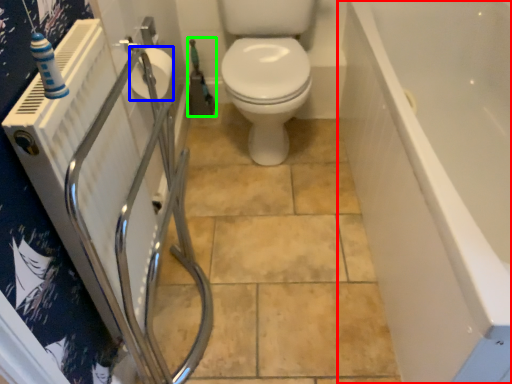
Question: Based on their relative distances, which object is farther from bath (highlighted by a red box)? Choose from toilet paper (highlighted by a blue box) and garden hose (highlighted by a green box).

Choices:
 (A) toilet paper
 (B) garden hose

Answer: (B)